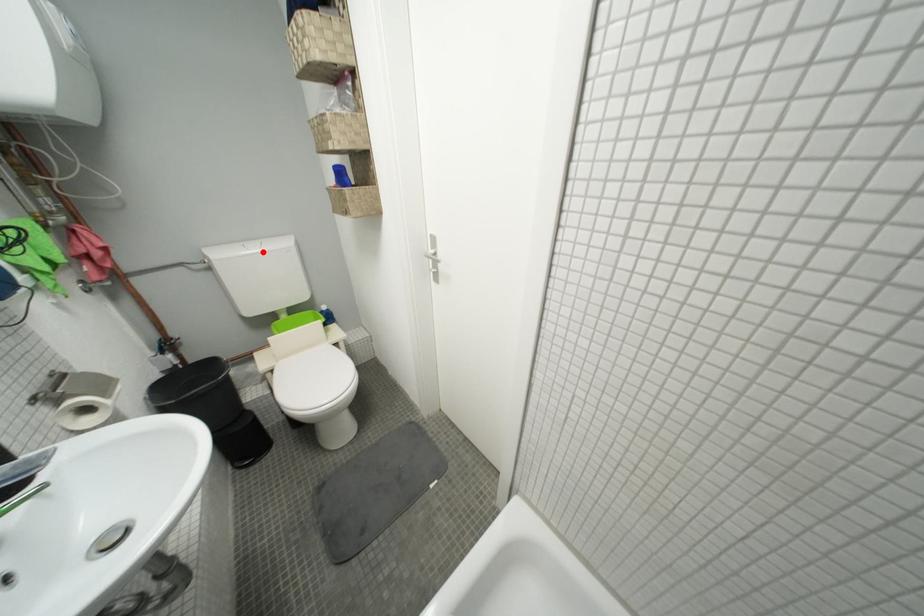
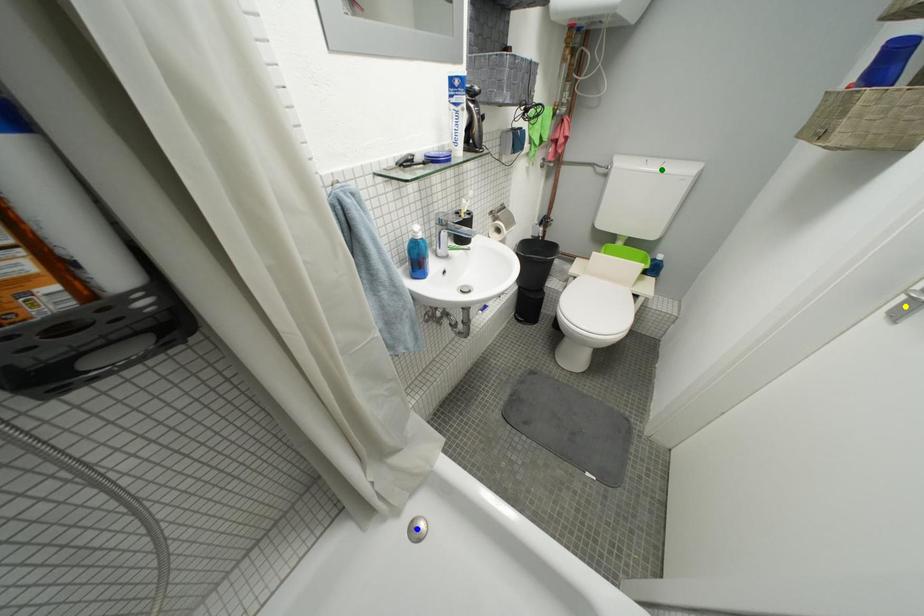
Question: I am providing you with two images of the same scene from different viewpoints. A red point is marked on the first image. You are given multiple points on the second image. Which spot in image 2 lines up with the point in image 1?

Choices:
 (A) blue point
 (B) green point
 (C) yellow point

Answer: (B)